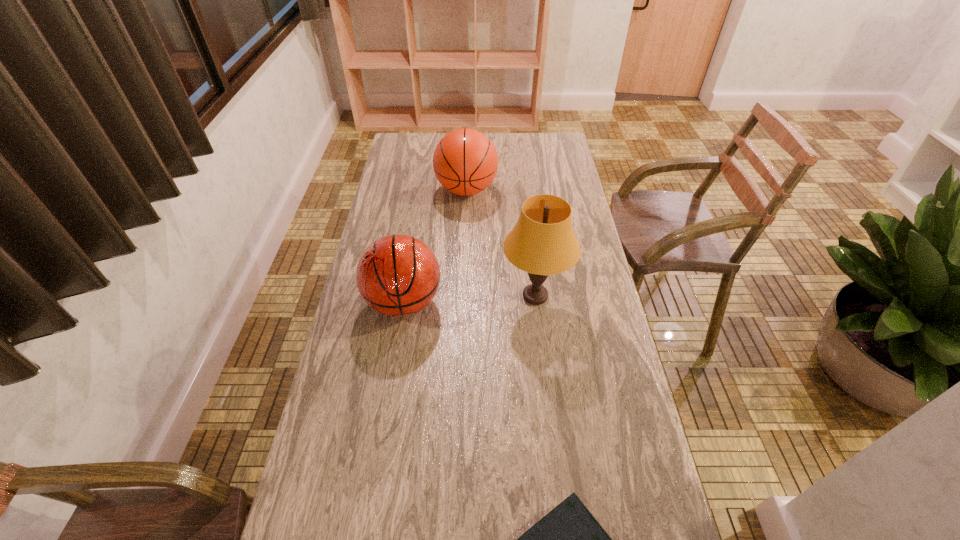
This screenshot has height=540, width=960. What are the coordinates of `the tallest object` in the screenshot? It's located at (x=542, y=243).

Find the location of `the farthest object`. the farthest object is located at coordinates (465, 162).

Locate an element on the screen. The height and width of the screenshot is (540, 960). the nearer basketball is located at coordinates (398, 275).

Locate an element on the screen. This screenshot has width=960, height=540. vacant space located 0.080m on the left of the tallest object is located at coordinates (476, 296).

Find the location of `vacant space located 0.160m on the right of the farther basketball`. vacant space located 0.160m on the right of the farther basketball is located at coordinates (537, 190).

Where is `blank space located 0.130m on the side with spill of the nearer basketball`? blank space located 0.130m on the side with spill of the nearer basketball is located at coordinates (393, 373).

Where is `object at the left edge`? Image resolution: width=960 pixels, height=540 pixels. object at the left edge is located at coordinates (398, 275).

Identify the location of object at the right edge. (542, 243).

The image size is (960, 540). I want to click on vacant space at the left edge, so click(359, 465).

In the image, there is a desktop. At what (x,y) coordinates should I click in order to perform the action: click on vacant space at the right edge. Please return your answer as a coordinate pair (x, y). Looking at the image, I should click on (563, 167).